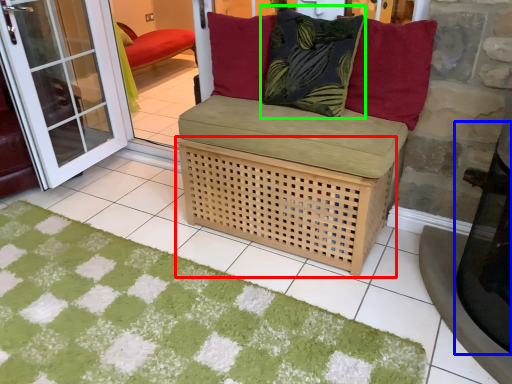
Question: Considering the real-world distances, which object is closest to basket (highlighted by a red box)? table (highlighted by a blue box) or pillow (highlighted by a green box).

Choices:
 (A) table
 (B) pillow

Answer: (B)